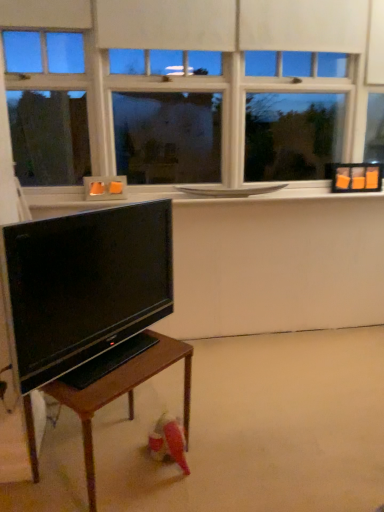
Where is `vacant space in wooden table at lower left (from a real-world perspective)`? vacant space in wooden table at lower left (from a real-world perspective) is located at coordinates (109, 477).